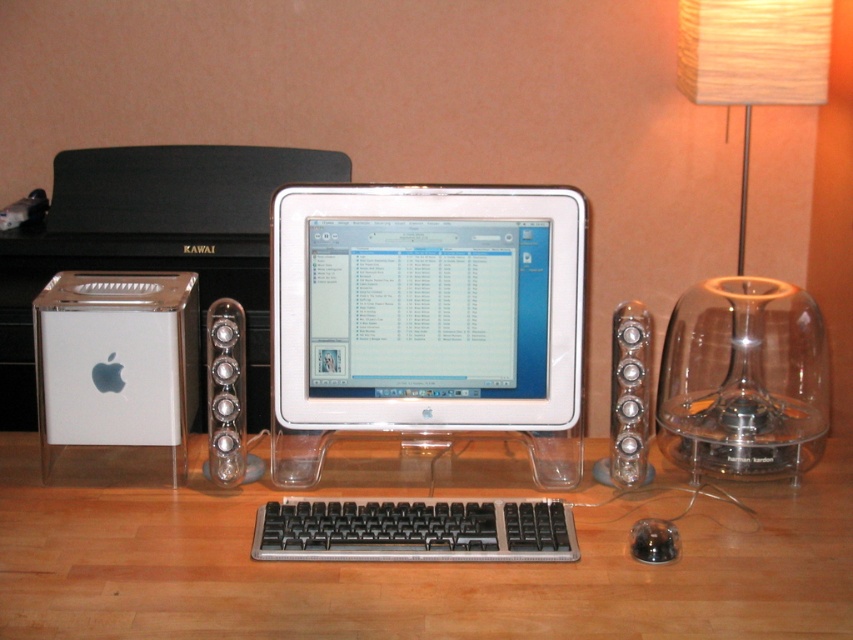
Is silver metallic speaker at right further to the viewer compared to satin silver speaker at center?

Yes, it is behind satin silver speaker at center.

Which is more to the left, silver metallic speaker at right or satin silver speaker at center?

satin silver speaker at center

Where is `silver metallic speaker at right`? The width and height of the screenshot is (853, 640). silver metallic speaker at right is located at coordinates click(630, 394).

Identify the location of silver metallic speaker at right. (630, 394).

Is white plastic ipod at left to the right of black plastic keyboard at center from the viewer's perspective?

In fact, white plastic ipod at left is to the left of black plastic keyboard at center.

Is point (91, 388) closer to camera compared to point (509, 560)?

No, (91, 388) is further to viewer.

Identify the location of white plastic ipod at left. (115, 376).

Who is positioned more to the right, clear plastic keyboard at center or white plastic ipod at left?

clear plastic keyboard at center

Which of these two, clear plastic keyboard at center or white plastic ipod at left, stands shorter?

clear plastic keyboard at center

Does point (642, 609) come behind point (165, 461)?

No, it is in front of (165, 461).

In order to click on clear plastic keyboard at center in this screenshot , I will do `click(416, 566)`.